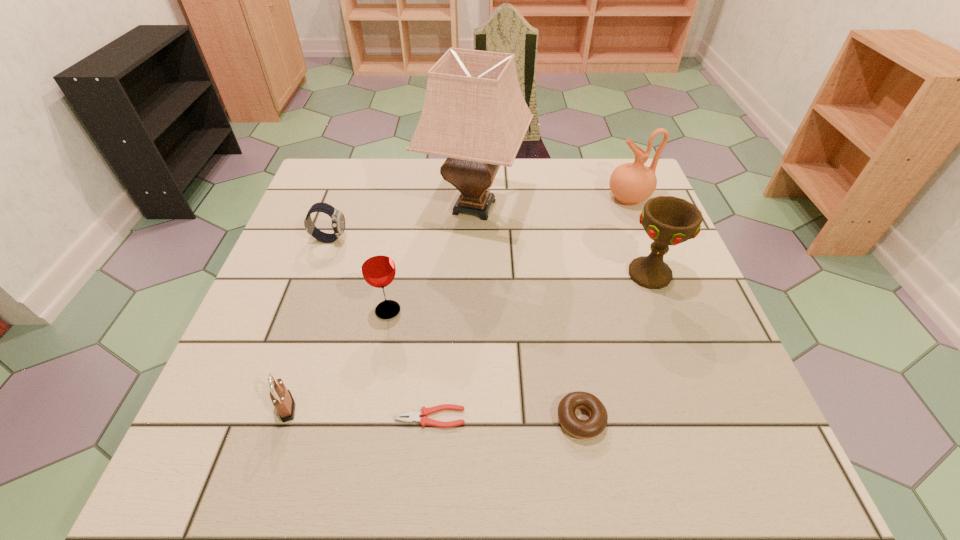
Where is `vacant area that lies between the chalice and the fourth nearest object`? vacant area that lies between the chalice and the fourth nearest object is located at coordinates (518, 293).

You are a GUI agent. You are given a task and a screenshot of the screen. Output one action in this format:
    pyautogui.click(x=<x>, y=<y>)
    Task: Click on the free space that is in between the watch and the padlock
    The image size is (960, 540).
    Given the screenshot: What is the action you would take?
    pyautogui.click(x=308, y=323)

I want to click on free space between the shortest object and the lampshade, so click(452, 312).

Select which object appears as the closest to the seventh tallest object. Please provide its 2D coordinates. Your answer should be formatted as a tuple, i.e. [(x, y)], where the tuple contains the x and y coordinates of a point satisfying the conditions above.

[(424, 412)]

Point out which object is positioned as the fourth nearest to the doughnut. Please provide its 2D coordinates. Your answer should be formatted as a tuple, i.e. [(x, y)], where the tuple contains the x and y coordinates of a point satisfying the conditions above.

[(474, 113)]

I want to click on vacant space that satisfies the following two spatial constraints: 1. on the face of the glass; 2. on the left side of the watch, so click(304, 310).

Where is `vacant space that satisfies the following two spatial constraints: 1. on the spout of the pottery; 2. on the front side of the fifth nearest object`? The height and width of the screenshot is (540, 960). vacant space that satisfies the following two spatial constraints: 1. on the spout of the pottery; 2. on the front side of the fifth nearest object is located at coordinates (659, 275).